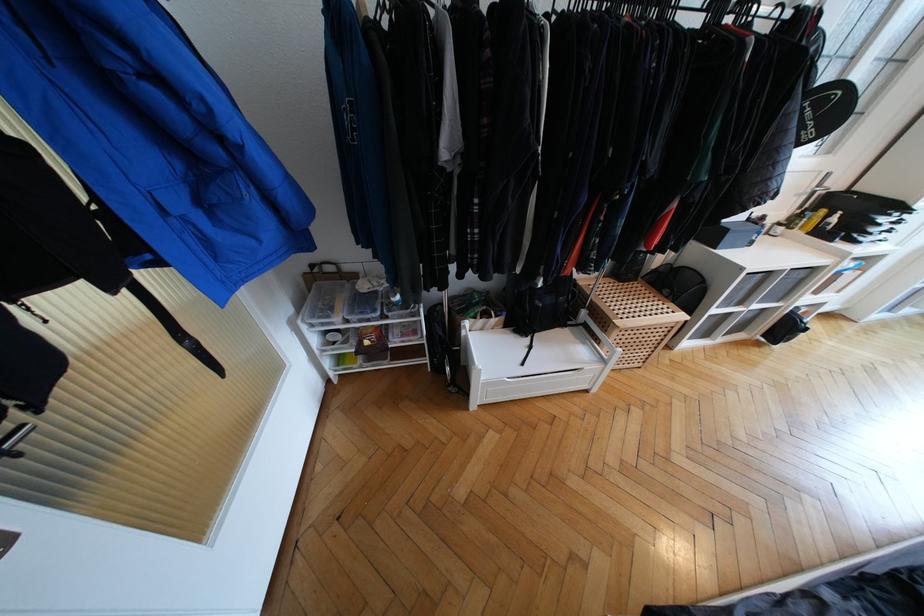
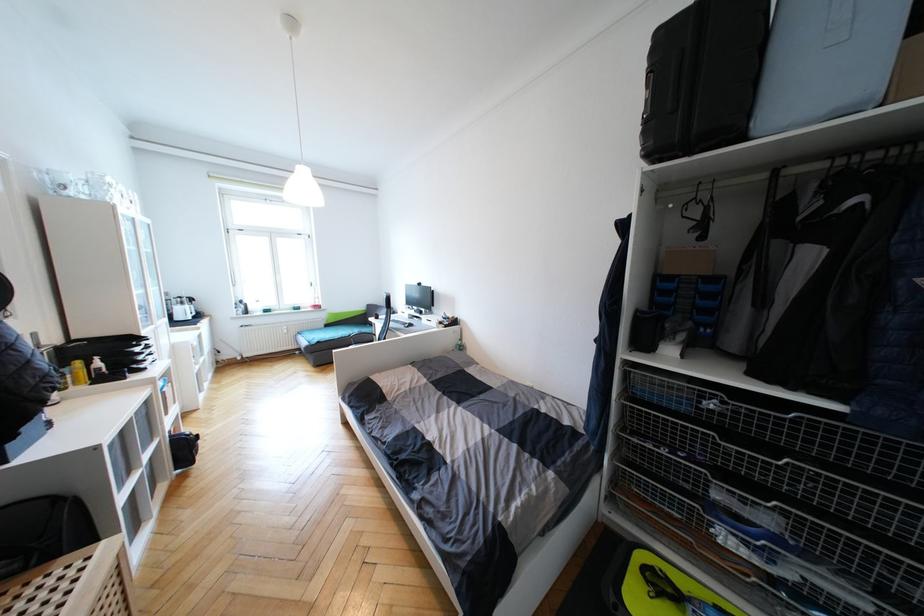
Where in the second image is the point corresponding to point (825, 213) from the first image?

(81, 363)